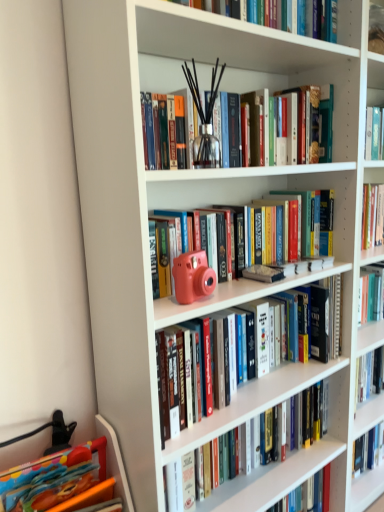
Question: Does hardcover book at center, which is counted as the 5th book, starting from the top, appear on the right side of matte pink camera at center, marked as the fourth book in a top-to-bottom arrangement?

Choices:
 (A) yes
 (B) no

Answer: (A)

Question: Is hardcover book at center, which is counted as the second book, starting from the bottom, outside matte pink camera at center, marked as the fourth book in a top-to-bottom arrangement?

Choices:
 (A) no
 (B) yes

Answer: (B)

Question: From a real-world perspective, is hardcover book at center, which is counted as the second book, starting from the bottom, located higher than matte pink camera at center, positioned as the third book in bottom-to-top order?

Choices:
 (A) no
 (B) yes

Answer: (A)

Question: Can you confirm if hardcover book at center, which is counted as the 5th book, starting from the top, is taller than matte pink camera at center, marked as the fourth book in a top-to-bottom arrangement?

Choices:
 (A) yes
 (B) no

Answer: (B)

Question: Is hardcover book at center, which is counted as the second book, starting from the bottom, facing towards matte pink camera at center, marked as the fourth book in a top-to-bottom arrangement?

Choices:
 (A) no
 (B) yes

Answer: (A)

Question: From the image's perspective, does hardcover book at center, which is counted as the 5th book, starting from the top, appear higher than matte pink camera at center, positioned as the third book in bottom-to-top order?

Choices:
 (A) yes
 (B) no

Answer: (B)

Question: From the image's perspective, is hardcover book at center, which is counted as the second book, starting from the bottom, beneath clear glass vase at upper center, which appears as the second book when viewed from the top?

Choices:
 (A) no
 (B) yes

Answer: (B)

Question: From a real-world perspective, is hardcover book at center, which is counted as the second book, starting from the bottom, positioned over clear glass vase at upper center, which appears as the second book when viewed from the top, based on gravity?

Choices:
 (A) no
 (B) yes

Answer: (A)

Question: Considering the relative sizes of hardcover book at center, which is counted as the 5th book, starting from the top, and clear glass vase at upper center, which appears as the second book when viewed from the top, in the image provided, is hardcover book at center, which is counted as the 5th book, starting from the top, wider than clear glass vase at upper center, which appears as the second book when viewed from the top,?

Choices:
 (A) yes
 (B) no

Answer: (A)

Question: Is hardcover book at center, which is counted as the second book, starting from the bottom, shorter than clear glass vase at upper center, which is the 5th book in bottom-to-top order?

Choices:
 (A) yes
 (B) no

Answer: (B)

Question: Is hardcover book at center, which is counted as the 5th book, starting from the top, thinner than clear glass vase at upper center, which is the 5th book in bottom-to-top order?

Choices:
 (A) yes
 (B) no

Answer: (B)

Question: Is hardcover book at center, which is counted as the second book, starting from the bottom, not near clear glass vase at upper center, which appears as the second book when viewed from the top?

Choices:
 (A) yes
 (B) no

Answer: (A)

Question: From a real-world perspective, is multicolored plastic toy at lower left, which is the 6th book in top-to-bottom order, positioned over matte pink camera at center, which is counted as the fourth book, starting from the bottom, based on gravity?

Choices:
 (A) yes
 (B) no

Answer: (B)